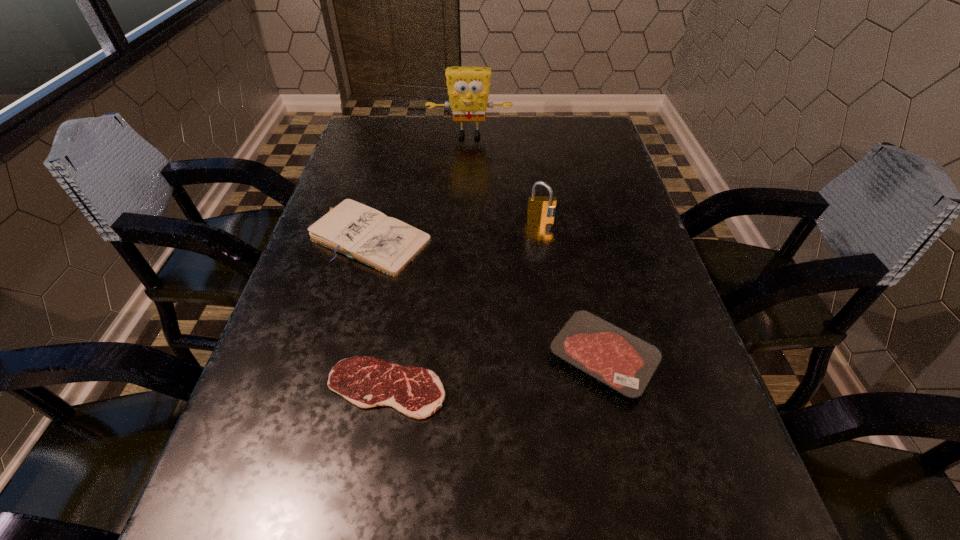
Image resolution: width=960 pixels, height=540 pixels. Find the location of `the farthest object`. the farthest object is located at coordinates (468, 87).

The width and height of the screenshot is (960, 540). I want to click on sponge, so click(468, 87).

This screenshot has height=540, width=960. Find the location of `the fourth shortest object`. the fourth shortest object is located at coordinates (540, 208).

Identify the location of notebook. This screenshot has width=960, height=540. (387, 244).

This screenshot has height=540, width=960. What are the coordinates of `the fourth tallest object` in the screenshot? It's located at (626, 363).

This screenshot has width=960, height=540. Identify the location of the taller steak. (626, 363).

Locate an element on the screen. the left steak is located at coordinates (417, 392).

I want to click on the shortest object, so click(x=417, y=392).

I want to click on free space located on the face of the farthest object, so click(468, 171).

Locate an element on the screen. The width and height of the screenshot is (960, 540). free space located on the side with the combination dials of the second tallest object is located at coordinates click(550, 280).